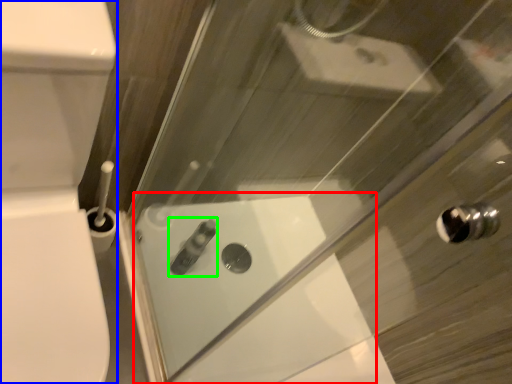
Question: Based on their relative distances, which object is nearer to bath (highlighted by a red box)? Choose from porcelain (highlighted by a blue box) and toiletry (highlighted by a green box).

Choices:
 (A) porcelain
 (B) toiletry

Answer: (B)